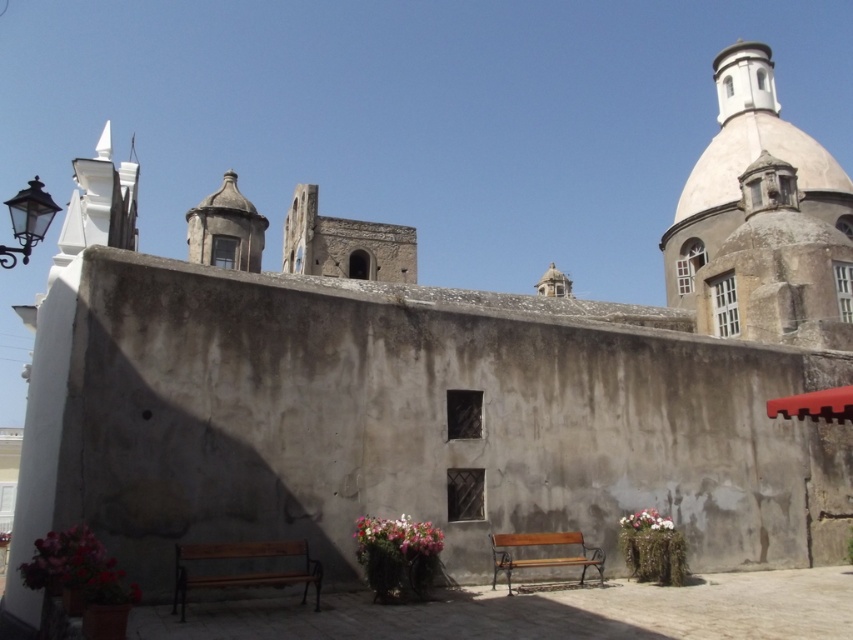
Who is lower down, pink fabric flower at lower left or wooden bench at center?

wooden bench at center

From the picture: Is pink fabric flower at lower left thinner than wooden bench at center?

Incorrect, pink fabric flower at lower left's width is not less than wooden bench at center's.

Is point (30, 566) closer to viewer compared to point (509, 580)?

That is True.

This screenshot has width=853, height=640. What are the coordinates of `pink fabric flower at lower left` in the screenshot? It's located at (77, 568).

Is the position of brown wooden bench at lower center more distant than that of pink fabric flowers at lower right?

That is False.

Does brown wooden bench at lower center appear over pink fabric flowers at lower right?

Correct, brown wooden bench at lower center is located above pink fabric flowers at lower right.

Does point (288, 545) come farther from viewer compared to point (627, 516)?

No, (288, 545) is in front of (627, 516).

The height and width of the screenshot is (640, 853). I want to click on brown wooden bench at lower center, so coord(242,570).

Which is more to the right, smooth beige dome at upper right or pink matte flower pot at center?

From the viewer's perspective, smooth beige dome at upper right appears more on the right side.

Is smooth beige dome at upper right positioned at the back of pink matte flower pot at center?

Yes, smooth beige dome at upper right is behind pink matte flower pot at center.

Is point (821, 172) closer to camera compared to point (376, 524)?

No, it is not.

Identify the location of smooth beige dome at upper right. The image size is (853, 640). (755, 144).